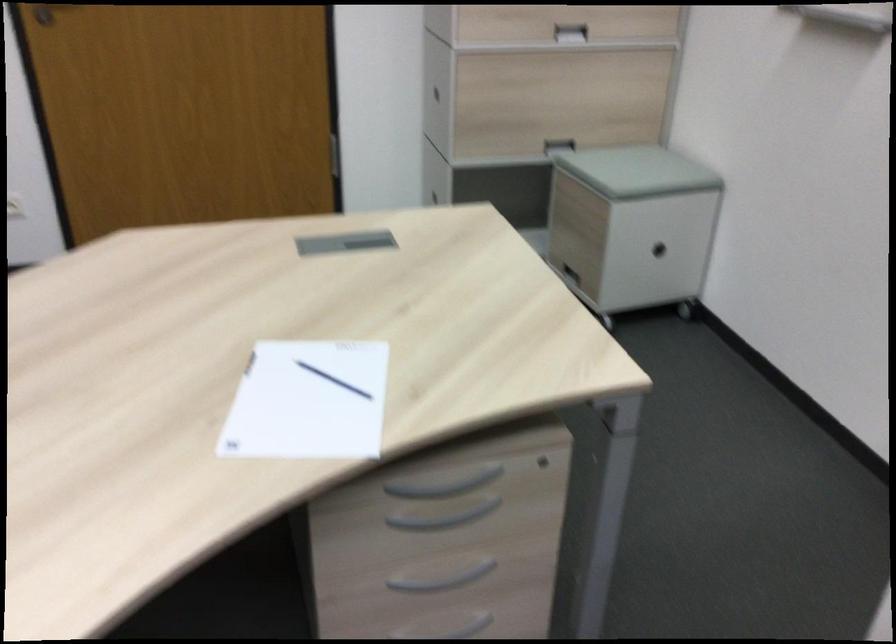
Find where to pull the cabinet hole handle. Please return your answer as a coordinate pair (x, y).

(569, 270)